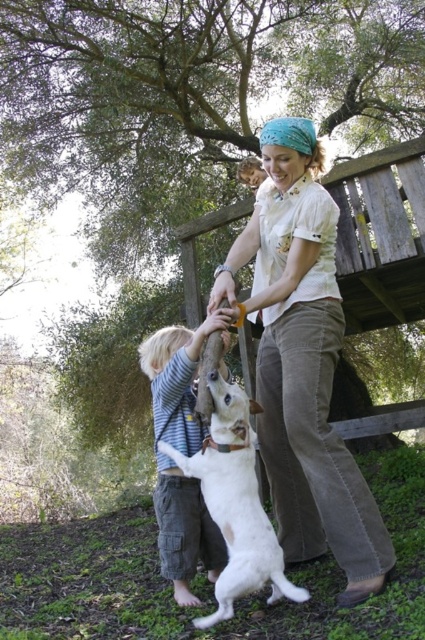
You are a photographer trying to capture a candid shot of the child and the dog in the scene. Since you want to focus on the child, you need to ensure the striped cotton shirt at center and light beige corduroy pants at center are in clear view. Which piece of clothing should you prioritize positioning closer to the camera to ensure both items are visible?

The light beige corduroy pants at center is already closer to the viewer than the striped cotton shirt at center. To ensure both are visible, position the light beige corduroy pants at center towards the camera so it doesn

You are taking a photo of the scene and want to focus on both the point at point (x=280, y=180) and point (x=302, y=600). Which point is closer to your camera?

Point (x=302, y=600) is closer to the camera than point (x=280, y=180) because the description states that point (x=280, y=180) is further away.

You are a fashion designer observing the child in the image. The child is wearing a striped cotton shirt at center and light beige corduroy pants at center. For a new collection, you need to know which piece of clothing is longer in length. Can you determine this based on the scene?

The light beige corduroy pants at center are much taller than the striped cotton shirt at center, so the pants are longer in length.